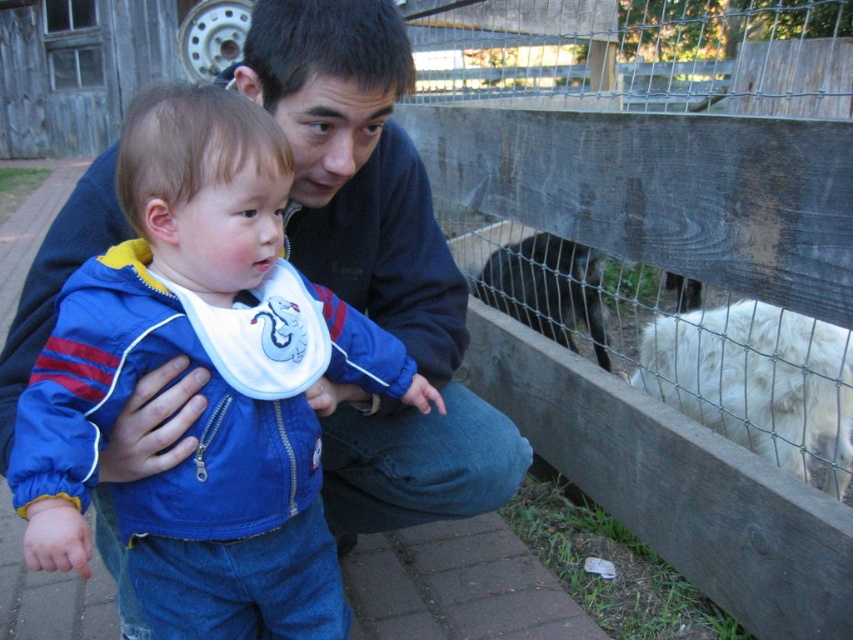
Based on the scene description, can you determine if the dark brown fur at upper center is inside or outside the wooden fence at center?

The dark brown fur at upper center is behind wooden fence at center, so it is inside the wooden fence at center.